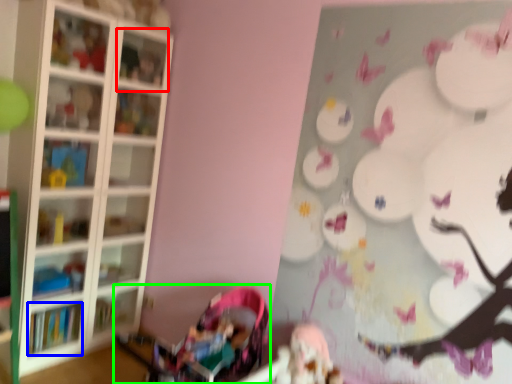
Question: Estimate the real-world distances between objects in this image. Which object is closer to cabinet (highlighted by a red box), book (highlighted by a blue box) or baby carriage (highlighted by a green box)?

Choices:
 (A) book
 (B) baby carriage

Answer: (B)